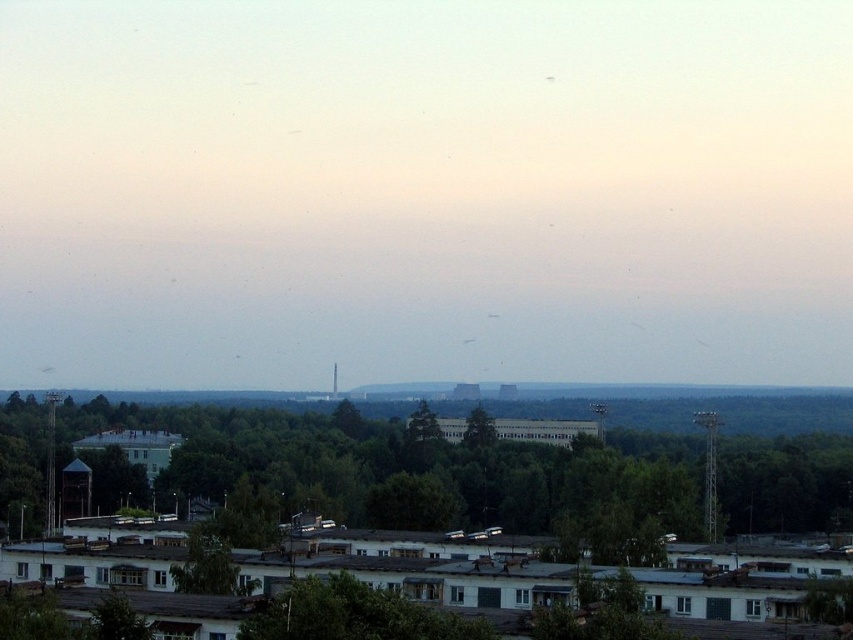
Question: Does green forest at center have a lesser width compared to green leafy tree at center?

Choices:
 (A) no
 (B) yes

Answer: (A)

Question: Among these objects, which one is nearest to the camera?

Choices:
 (A) green leafy tree at center
 (B) green forest at center
 (C) green leafy trees at center

Answer: (C)

Question: From the image, what is the correct spatial relationship of green leafy trees at center in relation to green leafy tree at center?

Choices:
 (A) left
 (B) right

Answer: (B)

Question: Which of the following is the closest to the observer?

Choices:
 (A) (465, 445)
 (B) (15, 433)
 (C) (296, 397)

Answer: (A)

Question: In this image, where is green leafy trees at center located relative to green forest at center?

Choices:
 (A) below
 (B) above

Answer: (A)

Question: Which object is the farthest from the green leafy tree at center?

Choices:
 (A) green leafy trees at center
 (B) green forest at center

Answer: (B)